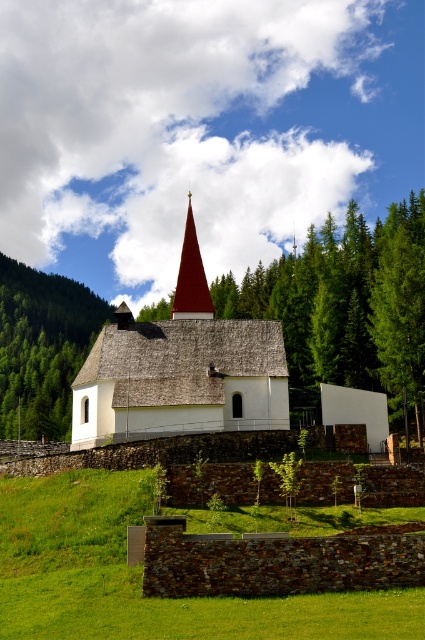
Who is lower down, green grass at lower center or smooth red spire at center?

green grass at lower center is below.

Who is positioned more to the left, green grass at lower center or smooth red spire at center?

smooth red spire at center is more to the left.

Is point (360, 628) farther from camera compared to point (186, 288)?

No, (360, 628) is closer to viewer.

Locate an element on the screen. green grass at lower center is located at coordinates (141, 577).

Is green grass at lower center wider than green textured tree at right?

Indeed, green grass at lower center has a greater width compared to green textured tree at right.

Does green grass at lower center appear over green textured tree at right?

No, green grass at lower center is not above green textured tree at right.

Is point (201, 611) in front of point (416, 278)?

Yes, point (201, 611) is in front of point (416, 278).

Locate an element on the screen. The image size is (425, 640). green grass at lower center is located at coordinates (141, 577).

Who is positioned more to the left, matte red roof at center or green textured tree at right?

From the viewer's perspective, matte red roof at center appears more on the left side.

Measure the distance between point (258, 356) and camera.

Point (258, 356) is 72.17 meters away from camera.

Find the location of a particular element. The height and width of the screenshot is (640, 425). matte red roof at center is located at coordinates (181, 369).